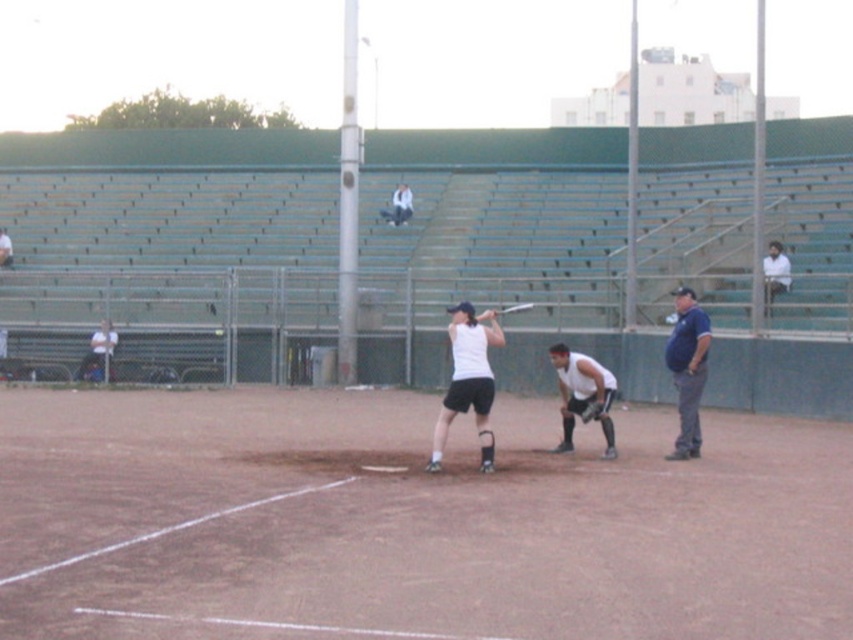
You are a spectator sitting at the back of the bleachers. You see a blue shirt at right and a white shirt at upper right. Which player is closer to the playing field?

The blue shirt at right is positioned under the white shirt at upper right, meaning it is closer to the playing field.

You are a coach observing the baseball game. You notice two bats at center field. Which bat is positioned to the left of the other? The bats are labeled as metallic silver bat at center and wooden baseball bat at center.

The metallic silver bat at center is positioned to the left of the wooden baseball bat at center.